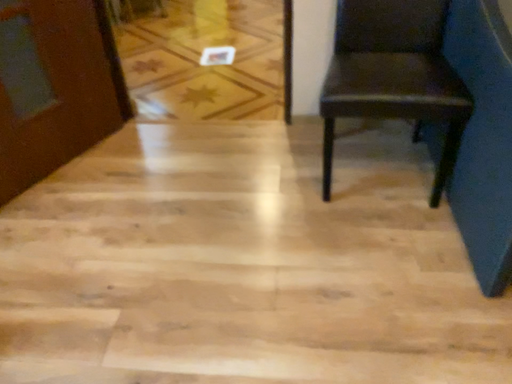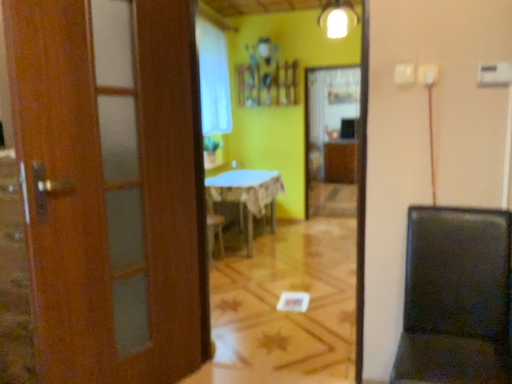
Question: How did the camera likely rotate when shooting the video?

Choices:
 (A) rotated upward
 (B) rotated downward

Answer: (A)